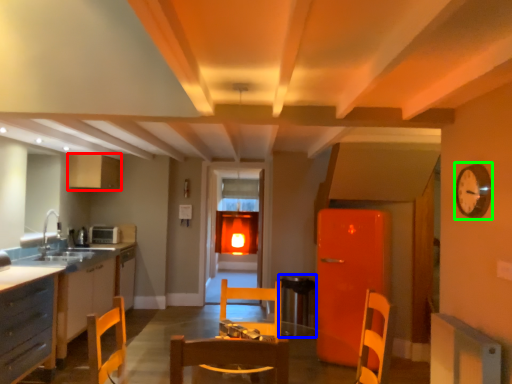
Question: Which object is positioned closest to cabinetry (highlighted by a red box)? Select from round table (highlighted by a blue box) and clock (highlighted by a green box).

Choices:
 (A) round table
 (B) clock

Answer: (A)